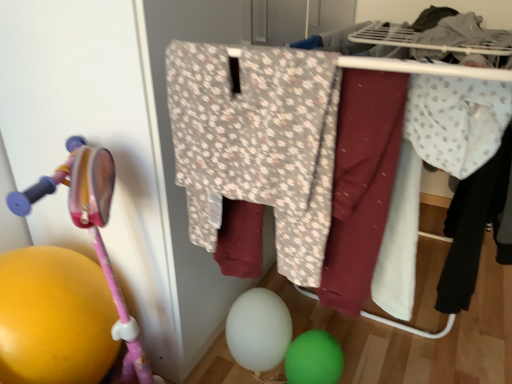
This screenshot has height=384, width=512. Describe the element at coordinates (314, 359) in the screenshot. I see `green rubber balloon at lower center, arranged as the first balloon when viewed from the right` at that location.

This screenshot has height=384, width=512. What do you see at coordinates (258, 330) in the screenshot? I see `white matte balloon at lower center, the 1th balloon from the left` at bounding box center [258, 330].

This screenshot has width=512, height=384. In order to click on green rubber balloon at lower center, arranged as the first balloon when viewed from the right in this screenshot , I will do `click(314, 359)`.

Between pink plastic baby carriage at left and light blue dotted fabric at right, which is counted as the first clothing, starting from the back, which one appears on the right side from the viewer's perspective?

light blue dotted fabric at right, which is counted as the first clothing, starting from the back, is more to the right.

From the image's perspective, which object appears higher, pink plastic baby carriage at left or light blue dotted fabric at right, which is the first clothing from right to left?

light blue dotted fabric at right, which is the first clothing from right to left, appears higher in the image.

Can we say pink plastic baby carriage at left lies outside light blue dotted fabric at right, the 3th clothing positioned from the left?

That's correct, pink plastic baby carriage at left is outside of light blue dotted fabric at right, the 3th clothing positioned from the left.

Where is `clothing behind the pink plastic baby carriage at left`? The height and width of the screenshot is (384, 512). clothing behind the pink plastic baby carriage at left is located at coordinates (474, 228).

Is floral fabric pants at center closer to the viewer compared to white matte balloon at lower center, which is counted as the 2th balloon, starting from the right?

Yes, it is in front of white matte balloon at lower center, which is counted as the 2th balloon, starting from the right.

Between floral fabric pants at center and white matte balloon at lower center, the 1th balloon from the left, which one has smaller width?

With smaller width is white matte balloon at lower center, the 1th balloon from the left.

Does floral fabric pants at center touch white matte balloon at lower center, the 1th balloon from the left?

There is a gap between floral fabric pants at center and white matte balloon at lower center, the 1th balloon from the left.

From the image's perspective, is floral fabric pants at center on white matte balloon at lower center, the 1th balloon from the left?

Yes, from the image's perspective, floral fabric pants at center is on top of white matte balloon at lower center, the 1th balloon from the left.

Can you tell me how much floral-patterned fabric at center, acting as the 1th clothing starting from the left, and green rubber balloon at lower center, which ranks as the second balloon in left-to-right order, differ in facing direction?

The angle between the facing direction of floral-patterned fabric at center, acting as the 1th clothing starting from the left, and the facing direction of green rubber balloon at lower center, which ranks as the second balloon in left-to-right order, is 9.31e-06 degrees.

Considering the sizes of objects floral-patterned fabric at center, which ranks as the 3th clothing in back-to-front order, and green rubber balloon at lower center, arranged as the first balloon when viewed from the right, in the image provided, who is shorter, floral-patterned fabric at center, which ranks as the 3th clothing in back-to-front order, or green rubber balloon at lower center, arranged as the first balloon when viewed from the right,?

Standing shorter between the two is green rubber balloon at lower center, arranged as the first balloon when viewed from the right.

Is floral-patterned fabric at center, which is counted as the third clothing, starting from the right, not near green rubber balloon at lower center, arranged as the first balloon when viewed from the right?

No, floral-patterned fabric at center, which is counted as the third clothing, starting from the right, is in close proximity to green rubber balloon at lower center, arranged as the first balloon when viewed from the right.

Is floral-patterned fabric at center, which ranks as the 3th clothing in back-to-front order, facing away from green rubber balloon at lower center, arranged as the first balloon when viewed from the right?

No.

Is light blue dotted fabric at right, the 3th clothing viewed from the front, to the left or to the right of white dotted fabric at right, which is the 2th clothing from front to back, in the image?

light blue dotted fabric at right, the 3th clothing viewed from the front, is positioned on white dotted fabric at right, which is the 2th clothing from front to back,'s right side.

Is the position of light blue dotted fabric at right, the 3th clothing positioned from the left, more distant than that of white dotted fabric at right, the 2th clothing viewed from the back?

Yes.

From a real-world perspective, who is located higher, light blue dotted fabric at right, the 3th clothing viewed from the front, or white dotted fabric at right, the 2th clothing viewed from the right?

From a 3D spatial view, white dotted fabric at right, the 2th clothing viewed from the right, is above.

Considering the relative sizes of light blue dotted fabric at right, which is counted as the first clothing, starting from the back, and white dotted fabric at right, which is the 2th clothing from front to back, in the image provided, is light blue dotted fabric at right, which is counted as the first clothing, starting from the back, wider than white dotted fabric at right, which is the 2th clothing from front to back,?

Yes, light blue dotted fabric at right, which is counted as the first clothing, starting from the back, is wider than white dotted fabric at right, which is the 2th clothing from front to back.

From a real-world perspective, is floral-patterned fabric at center, which ranks as the 3th clothing in back-to-front order, physically below light blue dotted fabric at right, the 3th clothing positioned from the left?

No, from a real-world perspective, floral-patterned fabric at center, which ranks as the 3th clothing in back-to-front order, is not beneath light blue dotted fabric at right, the 3th clothing positioned from the left.

From the image's perspective, who appears lower, floral-patterned fabric at center, which is counted as the third clothing, starting from the right, or light blue dotted fabric at right, which is the first clothing from right to left?

floral-patterned fabric at center, which is counted as the third clothing, starting from the right.

Is floral-patterned fabric at center, positioned as the first clothing in front-to-back order, turned away from light blue dotted fabric at right, which is counted as the first clothing, starting from the back?

No, floral-patterned fabric at center, positioned as the first clothing in front-to-back order,'s orientation is not away from light blue dotted fabric at right, which is counted as the first clothing, starting from the back.

Would you consider floral-patterned fabric at center, positioned as the first clothing in front-to-back order, to be distant from light blue dotted fabric at right, the 3th clothing positioned from the left?

No, floral-patterned fabric at center, positioned as the first clothing in front-to-back order, is not far away from light blue dotted fabric at right, the 3th clothing positioned from the left.

Are floral fabric pants at center and pink plastic baby carriage at left making contact?

floral fabric pants at center is not next to pink plastic baby carriage at left, and they're not touching.

Where is `closet above the pink plastic baby carriage at left (from a real-world perspective)`? The height and width of the screenshot is (384, 512). closet above the pink plastic baby carriage at left (from a real-world perspective) is located at coordinates (309, 138).

Is floral fabric pants at center situated inside pink plastic baby carriage at left or outside?

floral fabric pants at center is not inside pink plastic baby carriage at left, it's outside.

Consider the image. From a real-world perspective, is floral fabric pants at center above or below pink plastic baby carriage at left?

floral fabric pants at center is above pink plastic baby carriage at left.

From a real-world perspective, is white dotted fabric at right, which is the 2th clothing in left-to-right order, positioned under green rubber balloon at lower center, arranged as the first balloon when viewed from the right, based on gravity?

No.

Which object is closer to the camera, white dotted fabric at right, the 2th clothing viewed from the back, or green rubber balloon at lower center, which ranks as the second balloon in left-to-right order?

white dotted fabric at right, the 2th clothing viewed from the back.

Is white dotted fabric at right, the 2th clothing viewed from the right, situated inside green rubber balloon at lower center, which ranks as the second balloon in left-to-right order, or outside?

white dotted fabric at right, the 2th clothing viewed from the right, cannot be found inside green rubber balloon at lower center, which ranks as the second balloon in left-to-right order.

Is point (483, 83) closer or farther from the camera than point (292, 352)?

Point (483, 83) is closer to the camera than point (292, 352).

From the image's perspective, count 3rd clothings upward from the pink plastic baby carriage at left and point to it. Please provide its 2D coordinates.

[(474, 228)]

The width and height of the screenshot is (512, 384). I want to click on the 1st balloon below the floral fabric pants at center (from a real-world perspective), so click(258, 330).

Looking at the image, which one is located closer to pink plastic baby carriage at left, floral-patterned fabric at center, which ranks as the 3th clothing in back-to-front order, or white dotted fabric at right, the 2th clothing viewed from the right?

Among the two, floral-patterned fabric at center, which ranks as the 3th clothing in back-to-front order, is located nearer to pink plastic baby carriage at left.

Looking at the image, which one is located closer to green rubber balloon at lower center, arranged as the first balloon when viewed from the right, white dotted fabric at right, which is the 2th clothing in left-to-right order, or floral-patterned fabric at center, which ranks as the 3th clothing in back-to-front order?

floral-patterned fabric at center, which ranks as the 3th clothing in back-to-front order, is closer to green rubber balloon at lower center, arranged as the first balloon when viewed from the right.

Based on their spatial positions, is green rubber balloon at lower center, arranged as the first balloon when viewed from the right, or white matte balloon at lower center, which is counted as the 2th balloon, starting from the right, closer to white dotted fabric at right, the 2th clothing viewed from the right?

green rubber balloon at lower center, arranged as the first balloon when viewed from the right, is closer to white dotted fabric at right, the 2th clothing viewed from the right.

From the image, which object appears to be nearer to floral-patterned fabric at center, which ranks as the 3th clothing in back-to-front order, floral fabric pants at center or pink plastic baby carriage at left?

floral fabric pants at center.

Estimate the real-world distances between objects in this image. Which object is closer to pink plastic baby carriage at left, floral-patterned fabric at center, positioned as the first clothing in front-to-back order, or floral fabric pants at center?

floral-patterned fabric at center, positioned as the first clothing in front-to-back order, is closer to pink plastic baby carriage at left.

From the picture: Considering their positions, is light blue dotted fabric at right, which is counted as the first clothing, starting from the back, positioned further to white matte balloon at lower center, which is counted as the 2th balloon, starting from the right, than white dotted fabric at right, the 2th clothing viewed from the back?

The object further to white matte balloon at lower center, which is counted as the 2th balloon, starting from the right, is white dotted fabric at right, the 2th clothing viewed from the back.

When comparing their distances from pink plastic baby carriage at left, does floral fabric pants at center or floral-patterned fabric at center, which is counted as the third clothing, starting from the right, seem closer?

floral-patterned fabric at center, which is counted as the third clothing, starting from the right, lies closer to pink plastic baby carriage at left than the other object.

Considering their positions, is floral-patterned fabric at center, which ranks as the 3th clothing in back-to-front order, positioned closer to light blue dotted fabric at right, the 3th clothing positioned from the left, than pink plastic baby carriage at left?

floral-patterned fabric at center, which ranks as the 3th clothing in back-to-front order.

The width and height of the screenshot is (512, 384). I want to click on closet between pink plastic baby carriage at left and light blue dotted fabric at right, the 3th clothing viewed from the front, in the horizontal direction, so click(309, 138).

Where is `clothing between pink plastic baby carriage at left and green rubber balloon at lower center, arranged as the first balloon when viewed from the right, from left to right`? The height and width of the screenshot is (384, 512). clothing between pink plastic baby carriage at left and green rubber balloon at lower center, arranged as the first balloon when viewed from the right, from left to right is located at coordinates (257, 143).

Identify the location of clothing between floral fabric pants at center and light blue dotted fabric at right, the 3th clothing positioned from the left, in the horizontal direction. The height and width of the screenshot is (384, 512). (456, 120).

Locate an element on the screen. clothing between white dotted fabric at right, the 2th clothing viewed from the back, and green rubber balloon at lower center, arranged as the first balloon when viewed from the right, in the vertical direction is located at coordinates coord(257,143).